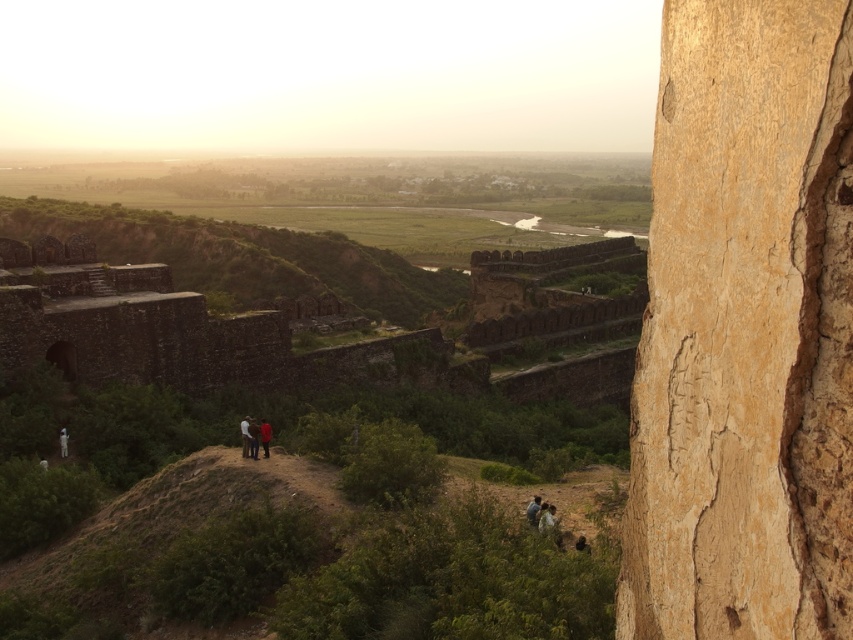
Can you confirm if dark blue shirt at center is positioned above dark blue jeans at center?

Indeed, dark blue shirt at center is positioned over dark blue jeans at center.

Can you confirm if dark blue shirt at center is wider than dark blue jeans at center?

Yes.

Locate an element on the screen. dark blue shirt at center is located at coordinates (245, 436).

The image size is (853, 640). I want to click on dark blue shirt at center, so click(x=245, y=436).

Which is in front, point (683, 625) or point (529, 502)?

Point (683, 625)

Find the location of `smooth beige rock at right`. smooth beige rock at right is located at coordinates (746, 330).

Is point (709, 282) positioned before point (534, 508)?

Yes, it is.

At what (x,y) coordinates should I click in order to perform the action: click on smooth beige rock at right. Please return your answer as a coordinate pair (x, y). The width and height of the screenshot is (853, 640). Looking at the image, I should click on (746, 330).

Is smooth beige rock at right to the left of dark blue jeans at center from the viewer's perspective?

In fact, smooth beige rock at right is to the right of dark blue jeans at center.

Between point (836, 516) and point (268, 429), which one is positioned in front?

Positioned in front is point (836, 516).

Find the location of `smooth beige rock at right`. smooth beige rock at right is located at coordinates (746, 330).